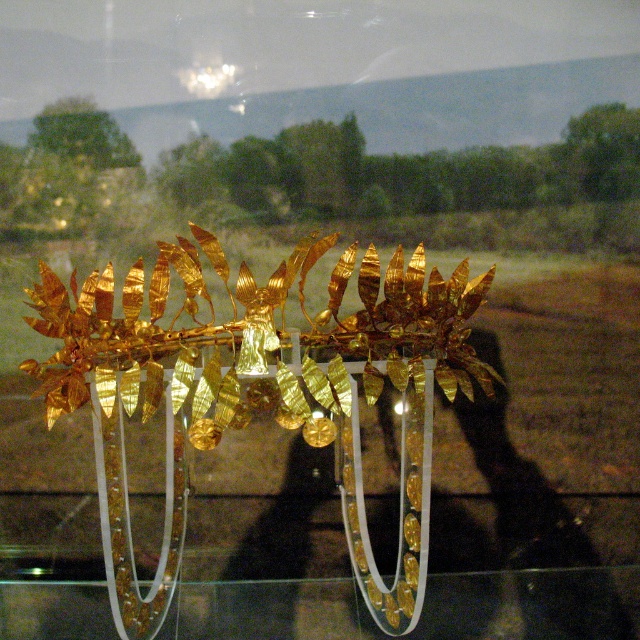
Is point (192, 288) more distant than point (634, 609)?

No, it is not.

In the scene shown: Does gold leafy tiara at center have a smaller size compared to transparent glass table at center?

No.

Describe the element at coordinates (253, 332) in the screenshot. This screenshot has width=640, height=640. I see `gold leafy tiara at center` at that location.

I want to click on gold leafy tiara at center, so click(253, 332).